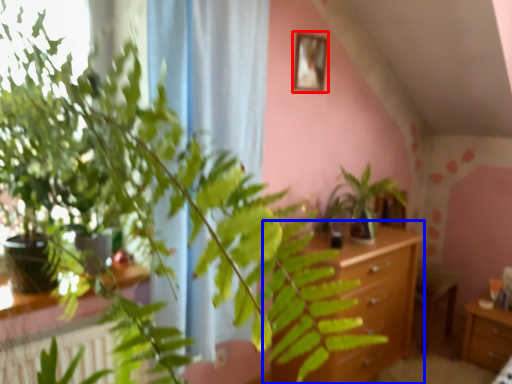
Question: Among these objects, which one is farthest to the camera, picture frame (highlighted by a red box) or vanity (highlighted by a blue box)?

Choices:
 (A) picture frame
 (B) vanity

Answer: (A)